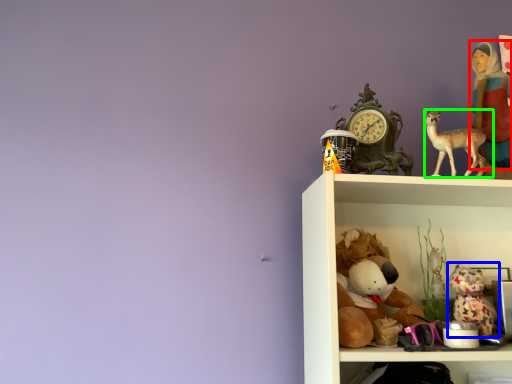
Question: Based on their relative distances, which object is nearer to person (highlighted by a red box)? Choose from toy (highlighted by a blue box) and deer (highlighted by a green box).

Choices:
 (A) toy
 (B) deer

Answer: (B)